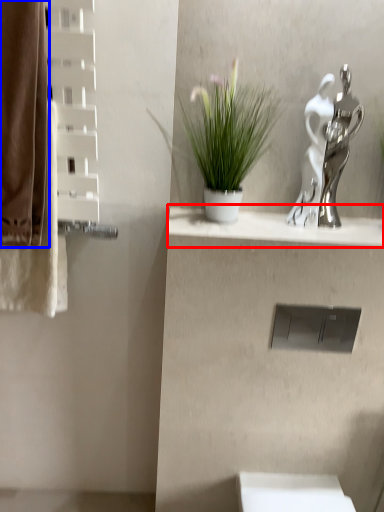
Question: Which of the following is the closest to the observer, balustrade (highlighted by a red box) or curtain (highlighted by a blue box)?

Choices:
 (A) balustrade
 (B) curtain

Answer: (B)